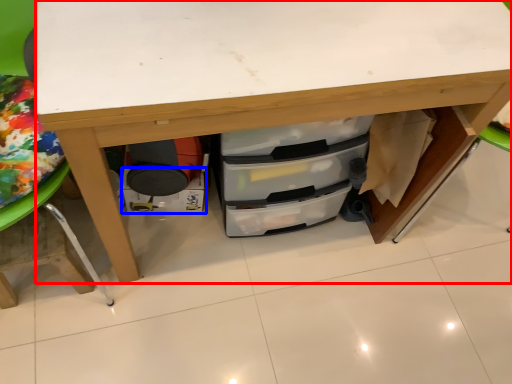
Question: Which object is further to the camera taking this photo, desk (highlighted by a red box) or drawer (highlighted by a blue box)?

Choices:
 (A) desk
 (B) drawer

Answer: (B)